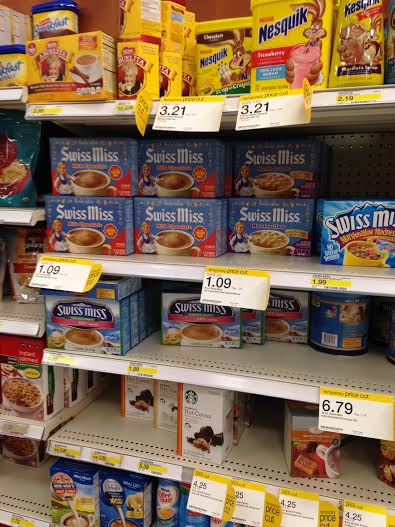
At what (x,y) coordinates should I click in order to perform the action: click on half and half individual creamers. Please return your answer as a coordinate pair (x, y). Image resolution: width=395 pixels, height=527 pixels. Looking at the image, I should click on (67, 496).